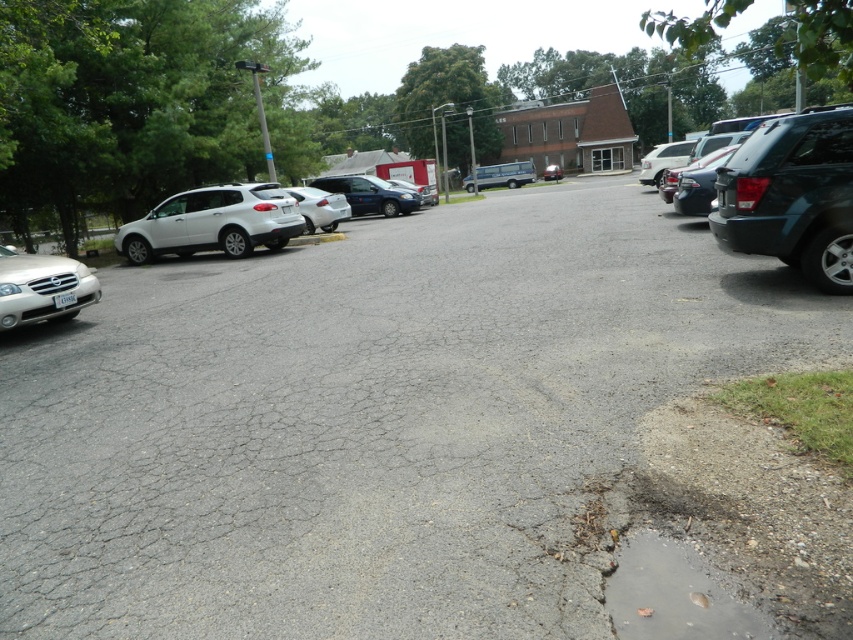
You are standing at the center of the parking lot and want to locate the teal matte suv at right. Based on the coordinates provided, in which direction should you look to find it?

The teal matte suv at right is located at coordinates point (792, 195), which corresponds to the right side of the parking lot. You should look to your right to find it.

You are a delivery person trying to avoid getting your shoes wet. You see the teal matte suv at right and the clear asphalt puddle at lower right. Which vehicle should you park near to stay dry?

The teal matte suv at right is positioned over the clear asphalt puddle at lower right, so parking near the teal matte suv at right would keep you dry as it blocks the puddle.

You are a delivery driver who needs to park your truck in the parking lot. There is a satin silver sedan at lower left. Can you park your truck without hitting the sedan?

The satin silver sedan at lower left is located at point [42,289]. Since the truck is larger than the sedan, you should park in a space away from the sedan to avoid collision.